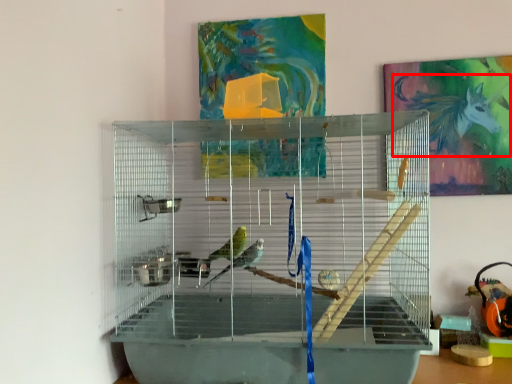
Question: From the image, what is the correct spatial relationship of animal (annotated by the red box) in relation to bird cage?

Choices:
 (A) right
 (B) left

Answer: (A)